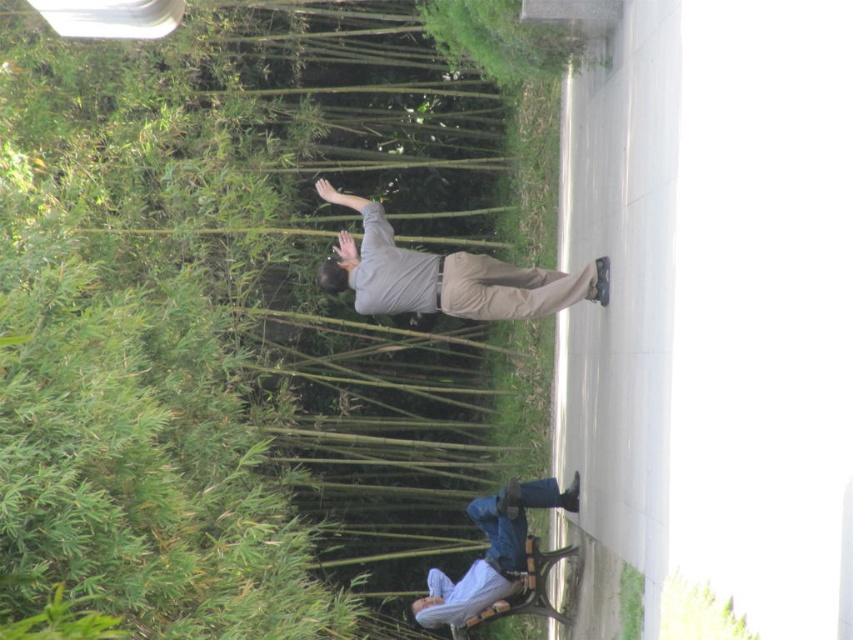
Question: Which point appears farthest from the camera in this image?

Choices:
 (A) (485, 308)
 (B) (367, 314)
 (C) (338, 140)

Answer: (C)

Question: Does green bamboo at upper left have a smaller size compared to gray matte shirt at center?

Choices:
 (A) no
 (B) yes

Answer: (A)

Question: Is blue denim jeans at lower right positioned at the back of khaki pants at center?

Choices:
 (A) no
 (B) yes

Answer: (B)

Question: Which object is farther from the camera taking this photo?

Choices:
 (A) blue denim jeans at lower right
 (B) green bamboo at upper left
 (C) gray matte shirt at center

Answer: (A)

Question: Which object appears farthest from the camera in this image?

Choices:
 (A) khaki pants at center
 (B) gray matte shirt at center
 (C) green bamboo at upper left
 (D) blue denim jeans at lower right

Answer: (D)

Question: Is gray matte shirt at center in front of blue denim jeans at lower right?

Choices:
 (A) yes
 (B) no

Answer: (A)